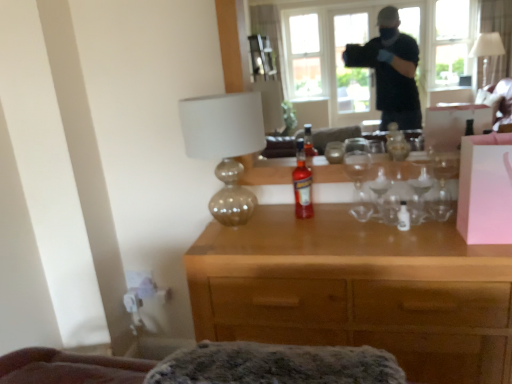
Identify the location of vacant location behind pink matte box at right. (434, 221).